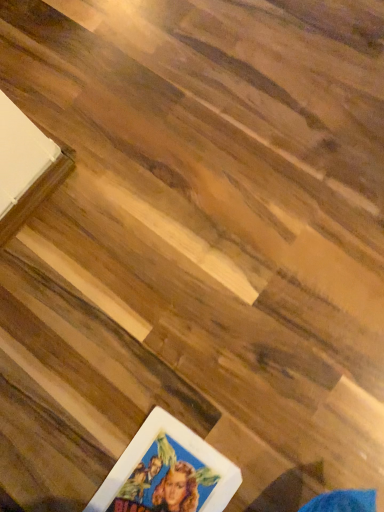
The image size is (384, 512). Find the location of `matte white book at lower center`. matte white book at lower center is located at coordinates (167, 472).

This screenshot has width=384, height=512. What do you see at coordinates (167, 472) in the screenshot? I see `matte white book at lower center` at bounding box center [167, 472].

In order to click on matte white book at lower center in this screenshot , I will do [167, 472].